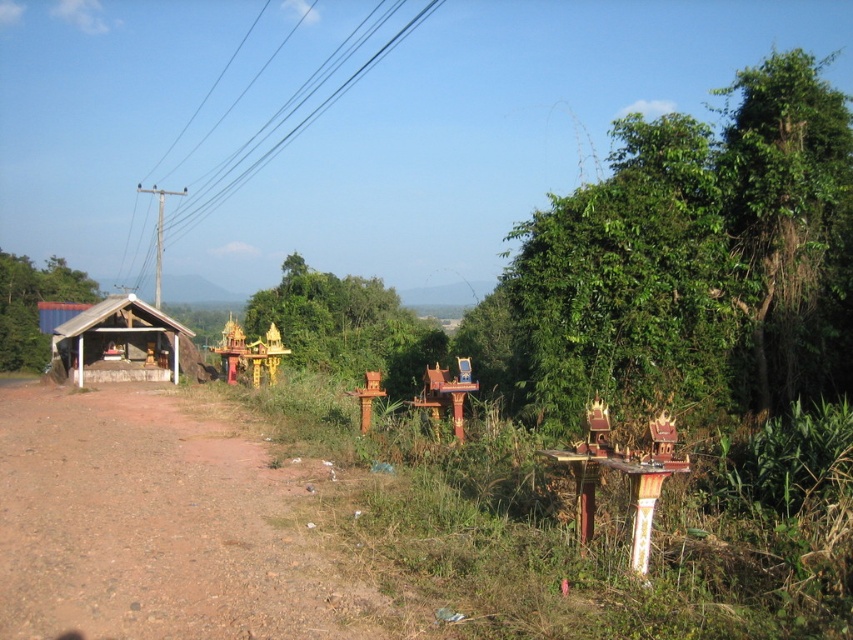
You are a hiker walking along the dirt road in the rural scene. You notice two green leafy trees ahead. The first one is the green leafy tree at left, and the second is the green leafy tree at center. Which tree will you encounter first as you continue walking along the road?

The green leafy tree at left will be encountered first because it is positioned to the left of the green leafy tree at center, meaning it is closer to the starting point along the road.

You are standing at the center of the image and want to locate the brown dirt track at lower left. According to the coordinates provided, in which direction should you look?

The brown dirt track at lower left is located at coordinates point (154, 528), so you should look downward and to the left from the center to find it.